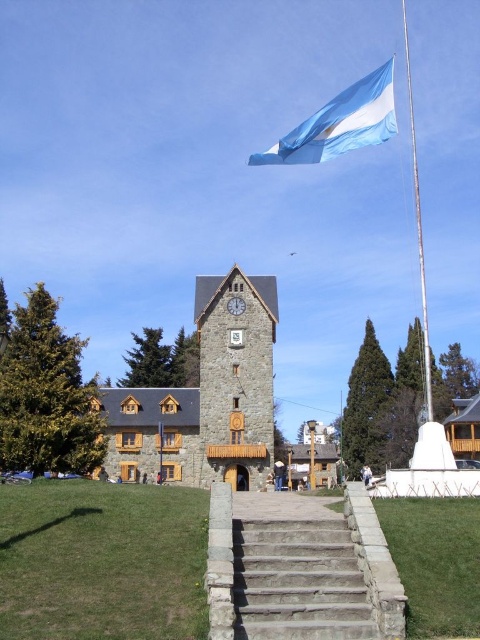
Question: In this image, where is stone clock tower at center located relative to white metallic flag pole at upper center?

Choices:
 (A) left
 (B) right

Answer: (A)

Question: Which of the following is the closest to the observer?

Choices:
 (A) coord(352,147)
 (B) coord(371,618)
 (C) coord(410,138)

Answer: (B)

Question: Which of the following is the farthest from the observer?

Choices:
 (A) (314, 579)
 (B) (354, 132)
 (C) (431, 376)

Answer: (C)

Question: Which point is closer to the camera?

Choices:
 (A) (240, 634)
 (B) (256, 376)

Answer: (A)

Question: Can you confirm if stone stairs at center is positioned to the right of white metallic flag pole at upper center?

Choices:
 (A) yes
 (B) no

Answer: (B)

Question: Can you confirm if stone clock tower at center is smaller than blue fabric flag at upper center?

Choices:
 (A) no
 (B) yes

Answer: (B)